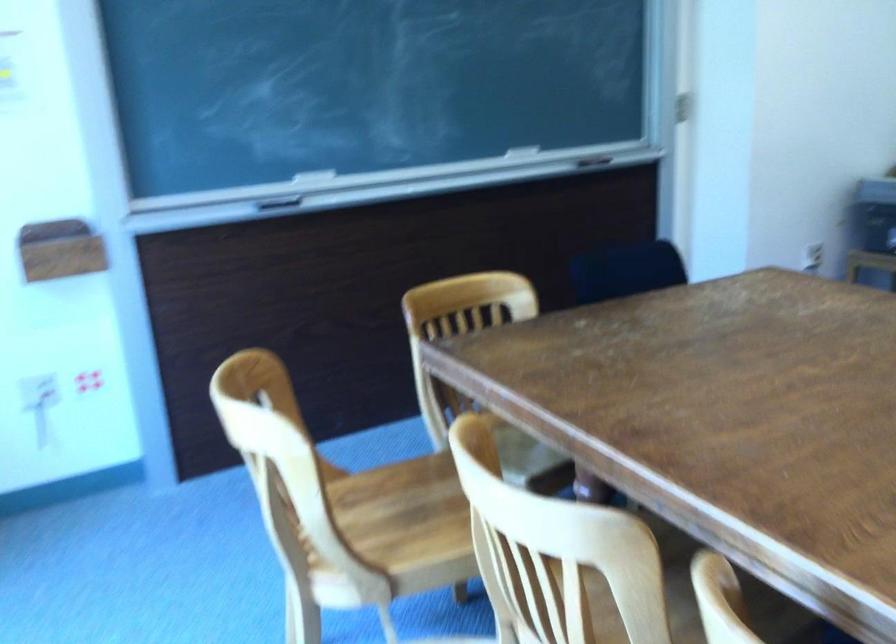
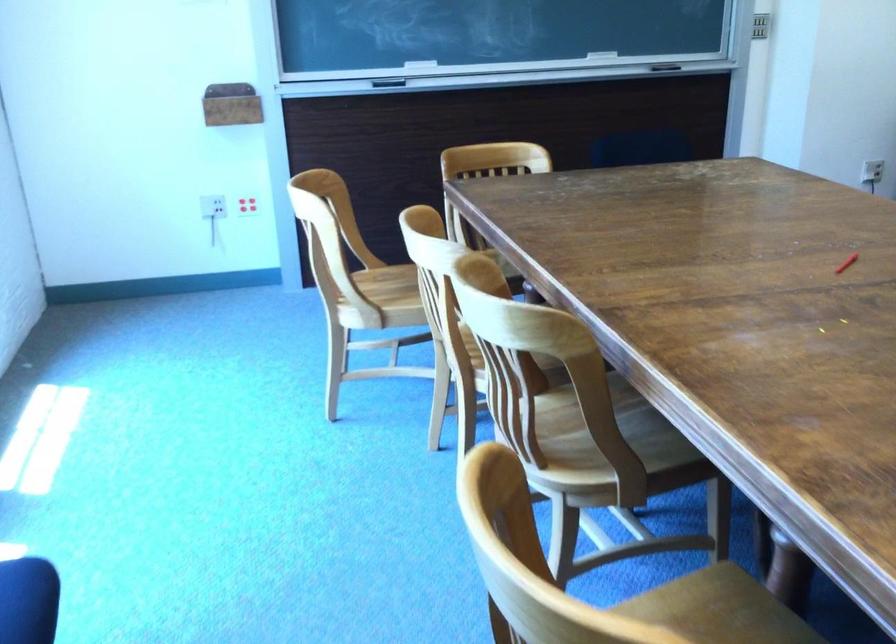
Find the pixel in the second image that matches (x=265, y=210) in the first image.

(389, 82)